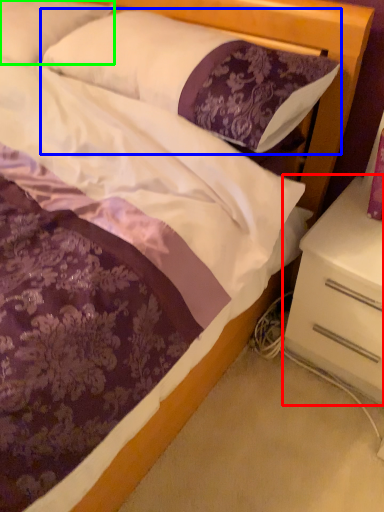
Question: Which object is the farthest from nightstand (highlighted by a red box)? Choose among these: pillow (highlighted by a blue box) or pillow (highlighted by a green box).

Choices:
 (A) pillow
 (B) pillow

Answer: (B)